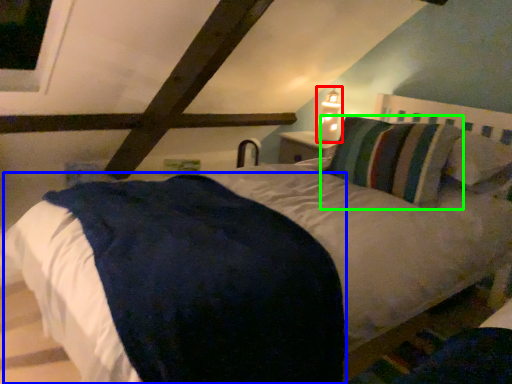
Question: Considering the real-world distances, which object is farthest from bedside lamp (highlighted by a red box)? mattress (highlighted by a blue box) or pillow (highlighted by a green box)?

Choices:
 (A) mattress
 (B) pillow

Answer: (A)